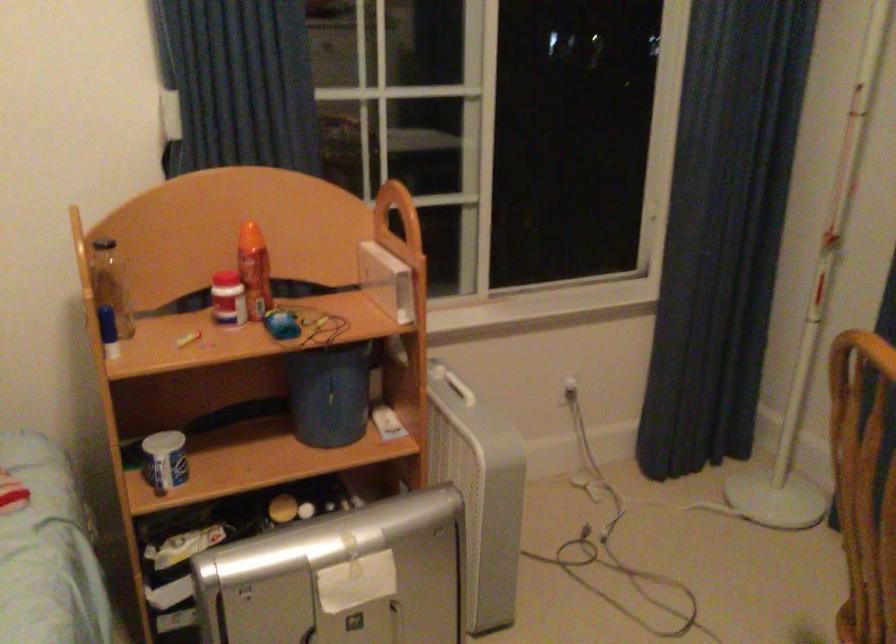
The width and height of the screenshot is (896, 644). Describe the element at coordinates (864, 484) in the screenshot. I see `the wooden chair armrest` at that location.